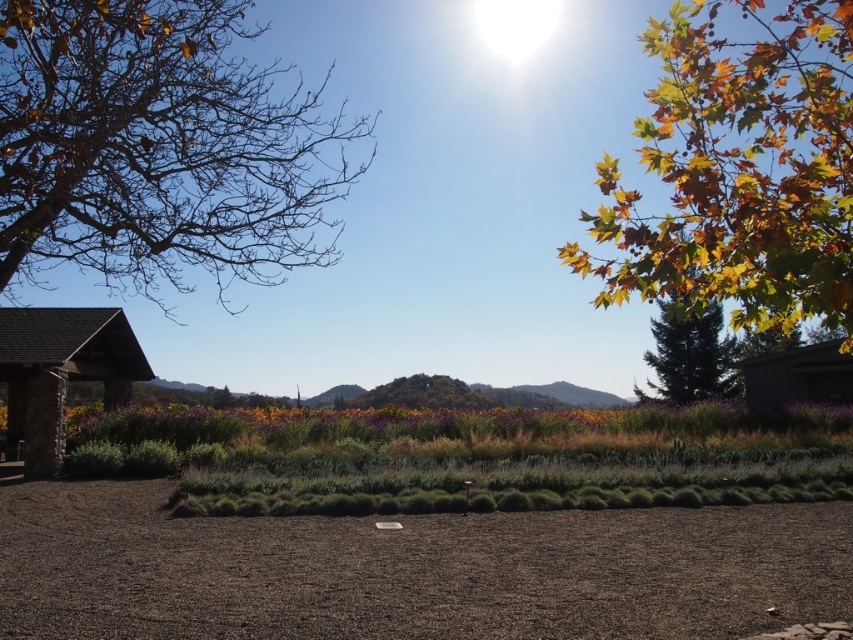
You are standing at the center of the dirt path in the foreground of the image. Looking towards the upper left corner, you notice a specific point marked at coordinates (x=160, y=147). What is located at that point?

The point at coordinates (x=160, y=147) marks bare branches at the upper left corner of the image.

You are a landscape architect designing a new garden layout. You need to place a 10 meter long decorative fence between the bare branches at upper left and the green matte tree at right. Is there enough space between them to place the fence?

The distance between the bare branches at upper left and the green matte tree at right is 14.58 meters, which is more than enough to accommodate a 10 meter long decorative fence between them.

Looking at this image, you are standing on the dark brown gravel at lower center and want to walk towards the golden leafy tree at upper right. Which direction should you move to get closer to the tree?

Since the dark brown gravel at lower center is closer to you than the golden leafy tree at upper right, you should move forward away from the gravel towards the tree.